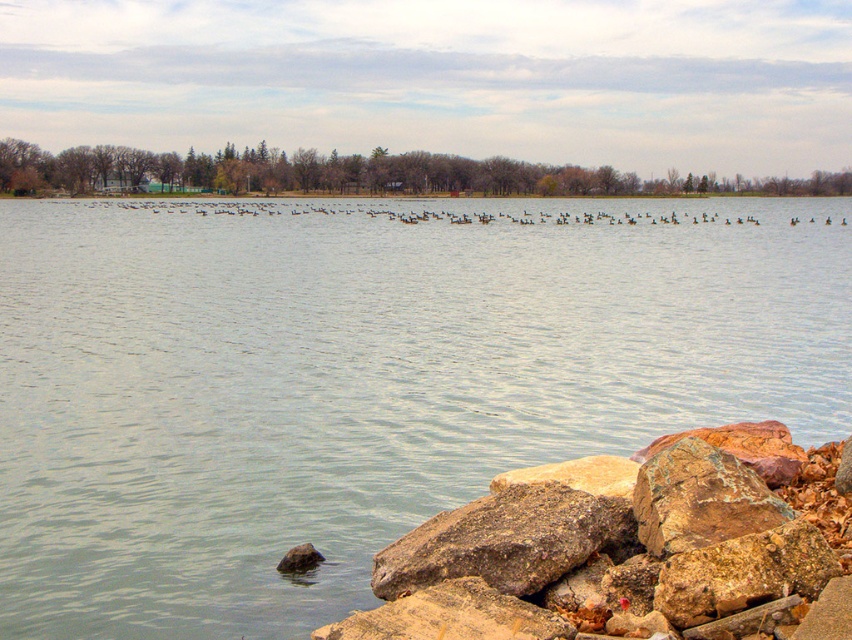
You are standing at the lakeside and want to reach the point marked as point (x=465, y=289) on the water. The distance between you and the point is 28.81 meters. If your walking speed is 1.5 meters per second, how many seconds will it take you to reach the point?

The distance between you and point (x=465, y=289) is 28.81 meters. At a walking speed of 1.5 meters per second, it will take approximately 19.21 seconds to reach the point.

In the scene shown: You are planning to cross the lake using a small boat that can only carry items up to the width of the rusty stone pile at lower right. Can you safely transport a large log that is as wide as the clear water at center?

The clear water at center is wider than the rusty stone pile at lower right. Since the log is as wide as the clear water at center, it exceeds the boat capacity which can only carry items up to the width of the rusty stone pile at lower right. Therefore, you cannot safely transport the log.